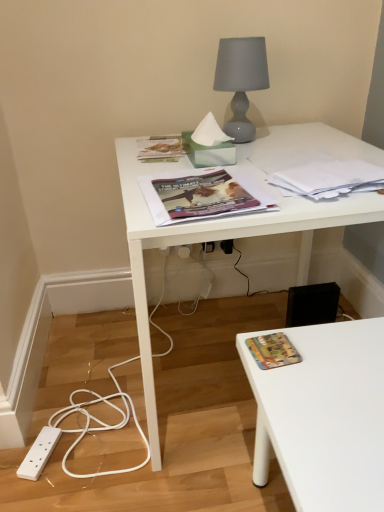
At what (x,y) coordinates should I click in order to perform the action: click on free space above white glossy desk at upper center (from a real-world perspective). Please return your answer as a coordinate pair (x, y). The width and height of the screenshot is (384, 512). Looking at the image, I should click on (256, 155).